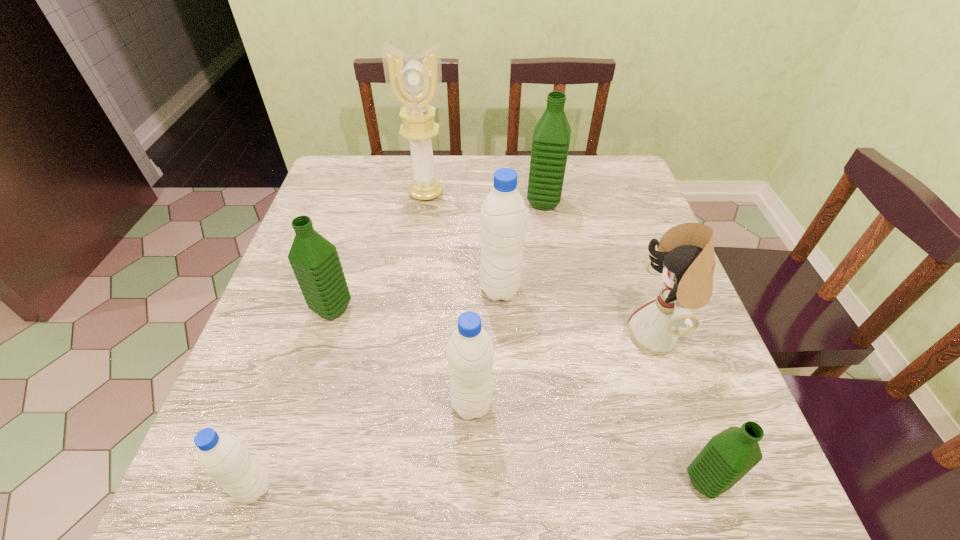
What are the coordinates of `vacant space at the far edge of the desktop` in the screenshot? It's located at (572, 198).

Image resolution: width=960 pixels, height=540 pixels. Find the location of `vacant region at the near edge of the desktop`. vacant region at the near edge of the desktop is located at coordinates (636, 458).

The width and height of the screenshot is (960, 540). I want to click on vacant space at the left edge of the desktop, so click(296, 424).

The image size is (960, 540). Identify the location of free location at the right edge of the desktop. (604, 227).

What are the coordinates of `free space between the nearest green water bottle and the second farthest green water bottle` in the screenshot? It's located at (518, 395).

You are a GUI agent. You are given a task and a screenshot of the screen. Output one action in this format:
    pyautogui.click(x=<x>, y=<y>)
    Task: Click on the free space between the leftmost green water bottle and the sixth object from right to left
    
    Given the screenshot: What is the action you would take?
    pyautogui.click(x=379, y=251)

The width and height of the screenshot is (960, 540). I want to click on vacant point located between the doll and the sixth farthest object, so click(x=564, y=370).

At what (x,y) coordinates should I click in order to perform the action: click on vacant space that's between the award and the nearest gray water bottle. Please return your answer as a coordinate pair (x, y). Looking at the image, I should click on (340, 341).

The image size is (960, 540). Find the location of `free space between the sixth farthest object and the doll`. free space between the sixth farthest object and the doll is located at coordinates (564, 370).

You are a GUI agent. You are given a task and a screenshot of the screen. Output one action in this format:
    pyautogui.click(x=<x>, y=<y>)
    Task: Click on the vacant area that lies between the nearest gray water bottle and the biggest gray water bottle
    Image resolution: width=960 pixels, height=540 pixels.
    Given the screenshot: What is the action you would take?
    pyautogui.click(x=377, y=389)